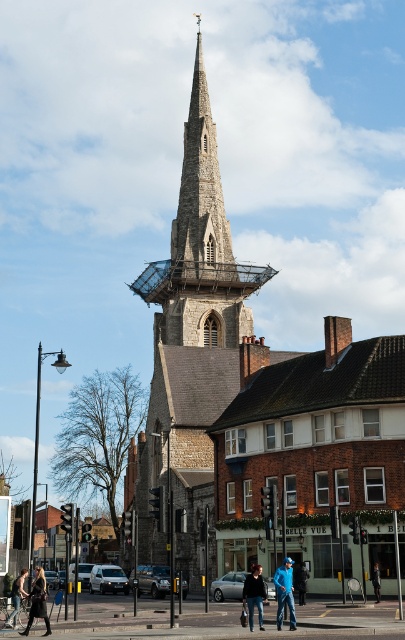
Question: Which of the following is the farthest from the observer?

Choices:
 (A) (12, 593)
 (B) (27, 632)

Answer: (A)

Question: Which of the following is the farthest from the observer?

Choices:
 (A) (377, 586)
 (B) (49, 627)

Answer: (A)

Question: Does dark blue jeans at center have a smaller size compared to black leather jacket at lower left?

Choices:
 (A) yes
 (B) no

Answer: (A)

Question: Is stone steeple at center below dark blue jeans at center?

Choices:
 (A) no
 (B) yes

Answer: (A)

Question: Does stone steeple at center appear on the left side of blue denim jeans at center?

Choices:
 (A) no
 (B) yes

Answer: (B)

Question: Which point is closer to the camera?

Choices:
 (A) denim jacket at center
 (B) blue denim jeans at center
 (C) stone steeple at center

Answer: (B)